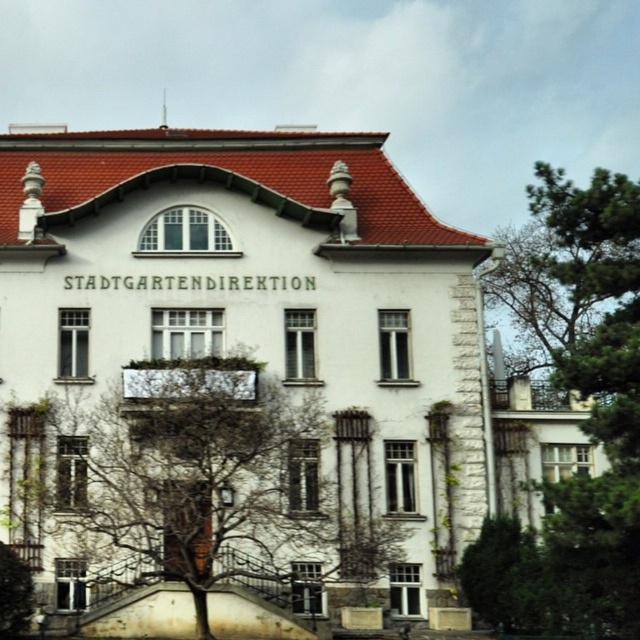
Does point (129, 368) come farther from viewer compared to point (538, 611)?

Yes.

Identify the location of bare branches at lower left. (204, 477).